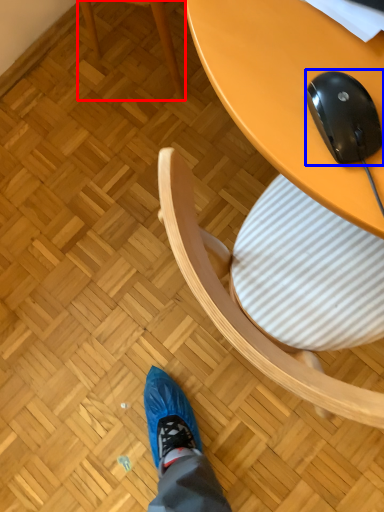
Question: Which object is closer to the camera taking this photo, chair (highlighted by a red box) or mouse (highlighted by a blue box)?

Choices:
 (A) chair
 (B) mouse

Answer: (B)